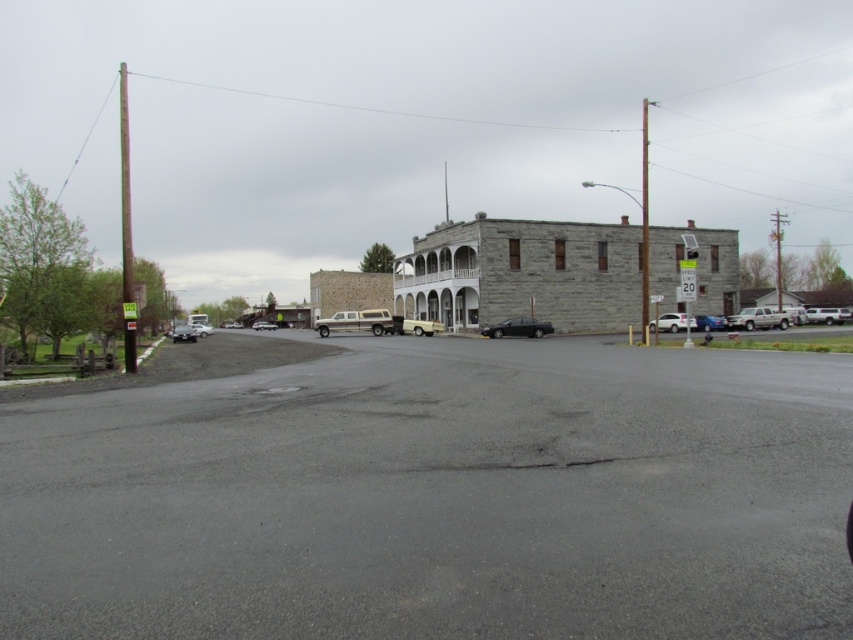
You are a delivery driver trying to park your vehicle in the space between the white matte truck at center and the metallic silver sedan at center. The parking space is 2.5 meters wide. Can your 2.2 meter wide van fit in the space?

The white matte truck at center might be wider than metallic silver sedan at center, so the available space between them may not be sufficient for a 2.2 meter wide van. Check the actual width of the vehicles before attempting to park.

You are a delivery driver who needs to park your 2.5 meters wide truck in this scene. You see the metallic silver car at lower left and the metallic silver suv at center. Which parking spot between them can accommodate your truck?

The metallic silver suv at center has a greater width than the metallic silver car at lower left. Since your truck is 2.5 meters wide, you should choose the parking spot next to the metallic silver suv at center as it likely has more space available.